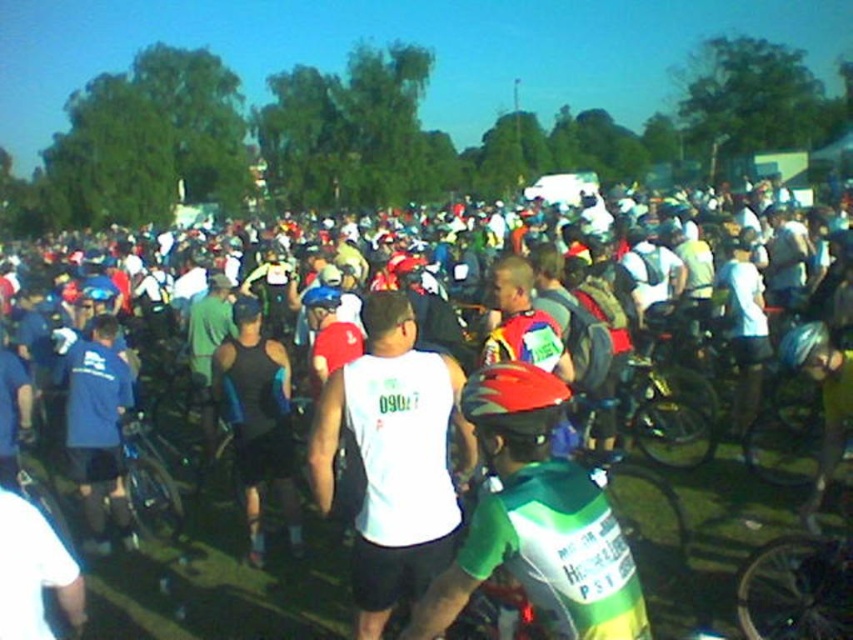
Does white matte tank top at center appear on the left side of shiny red helmet at center?

Yes, white matte tank top at center is to the left of shiny red helmet at center.

Which is above, white matte tank top at center or shiny red helmet at center?

shiny red helmet at center is above.

This screenshot has height=640, width=853. What do you see at coordinates (393, 458) in the screenshot? I see `white matte tank top at center` at bounding box center [393, 458].

Identify the location of white matte tank top at center. The height and width of the screenshot is (640, 853). (393, 458).

Which is in front, point (796, 349) or point (329, 292)?

Point (796, 349)

Identify the location of blue matte bicycle helmet at center-right. (804, 342).

Does white matte tank top at center have a smaller size compared to blue matte bicycle helmet at center-right?

Actually, white matte tank top at center might be larger than blue matte bicycle helmet at center-right.

Who is lower down, white matte tank top at center or blue matte bicycle helmet at center-right?

Positioned lower is white matte tank top at center.

Find the location of a particular element. white matte tank top at center is located at coordinates (393, 458).

Locate an element on the screen. The height and width of the screenshot is (640, 853). white matte tank top at center is located at coordinates (393, 458).